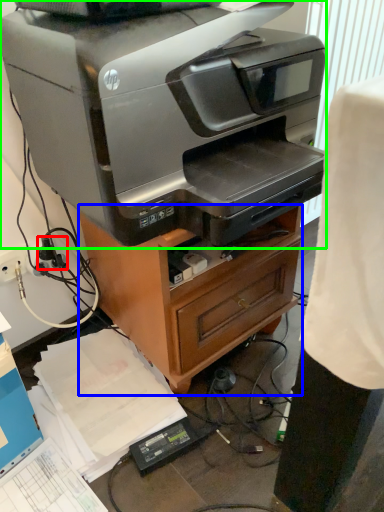
Question: Which object is positioned farthest from plug (highlighted by a red box)? Select from furniture (highlighted by a blue box) and printer (highlighted by a green box).

Choices:
 (A) furniture
 (B) printer

Answer: (B)